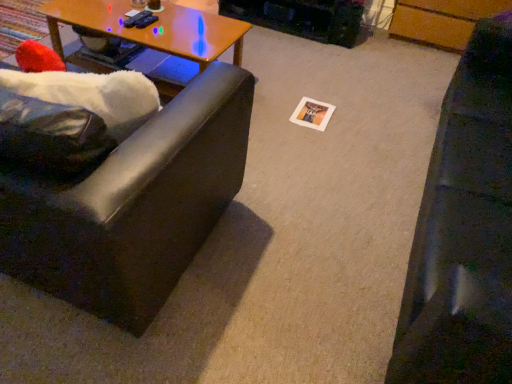
Question: From a real-world perspective, does matte black couch at left, which is counted as the 2th studio couch, starting from the right, stand above matte brown coffee cup at upper center?

Choices:
 (A) yes
 (B) no

Answer: (B)

Question: Can you confirm if matte black couch at left, which is counted as the 2th studio couch, starting from the right, is bigger than matte brown coffee cup at upper center?

Choices:
 (A) yes
 (B) no

Answer: (A)

Question: Is matte black couch at left, which is counted as the first studio couch, starting from the left, not inside matte brown coffee cup at upper center?

Choices:
 (A) yes
 (B) no

Answer: (A)

Question: From the image's perspective, would you say matte black couch at left, which is counted as the first studio couch, starting from the left, is shown under matte brown coffee cup at upper center?

Choices:
 (A) yes
 (B) no

Answer: (A)

Question: Does matte black couch at left, which is counted as the 2th studio couch, starting from the right, have a greater width compared to matte brown coffee cup at upper center?

Choices:
 (A) yes
 (B) no

Answer: (A)

Question: From the image's perspective, is matte black couch at left, which is counted as the 2th studio couch, starting from the right, on matte brown coffee cup at upper center?

Choices:
 (A) no
 (B) yes

Answer: (A)

Question: Is wooden at left inside matte black couch at left, which is counted as the 2th studio couch, starting from the right?

Choices:
 (A) no
 (B) yes

Answer: (A)

Question: Is matte black couch at left, which is counted as the 2th studio couch, starting from the right, smaller than wooden at left?

Choices:
 (A) no
 (B) yes

Answer: (A)

Question: From the image's perspective, would you say matte black couch at left, which is counted as the first studio couch, starting from the left, is shown under wooden at left?

Choices:
 (A) yes
 (B) no

Answer: (A)

Question: Is the position of matte black couch at left, which is counted as the first studio couch, starting from the left, more distant than that of wooden at left?

Choices:
 (A) yes
 (B) no

Answer: (B)

Question: Is matte black couch at left, which is counted as the first studio couch, starting from the left, shorter than wooden at left?

Choices:
 (A) no
 (B) yes

Answer: (A)

Question: Are matte black couch at left, which is counted as the first studio couch, starting from the left, and wooden at left making contact?

Choices:
 (A) yes
 (B) no

Answer: (B)

Question: Does wooden at left have a larger size compared to matte brown coffee cup at upper center?

Choices:
 (A) no
 (B) yes

Answer: (B)